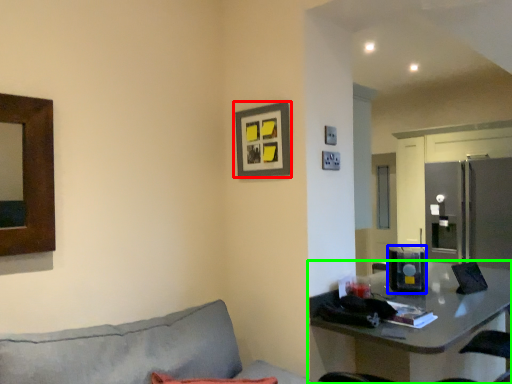
Question: Based on their relative distances, which object is farther from picture frame (highlighted by a red box)? Choose from appliance (highlighted by a blue box) and table (highlighted by a green box).

Choices:
 (A) appliance
 (B) table

Answer: (A)